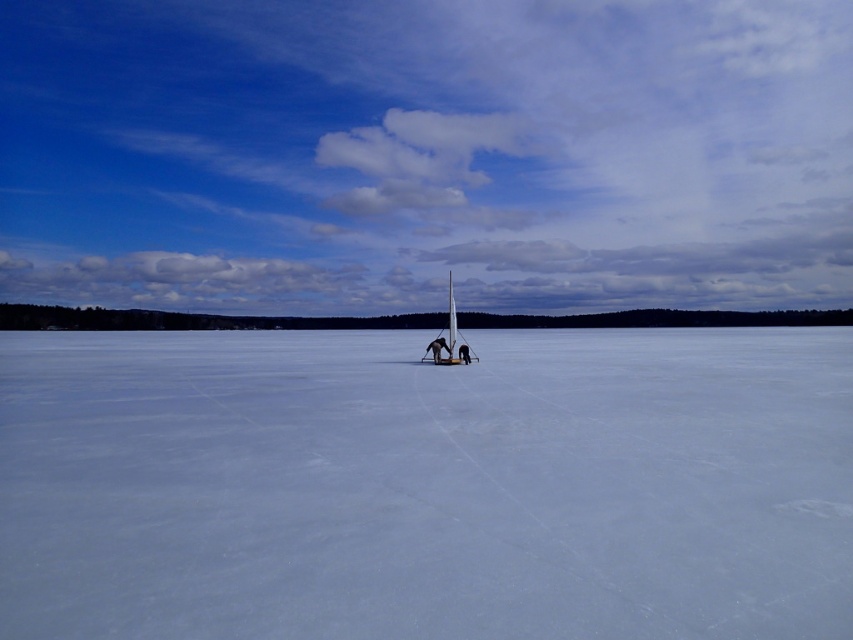
Which is below, white smooth ice at center or white plastic sailboat at center?

white smooth ice at center

This screenshot has height=640, width=853. Find the location of `white smooth ice at center`. white smooth ice at center is located at coordinates (427, 484).

This screenshot has width=853, height=640. What do you see at coordinates (427, 484) in the screenshot?
I see `white smooth ice at center` at bounding box center [427, 484].

Where is `white smooth ice at center`? white smooth ice at center is located at coordinates (427, 484).